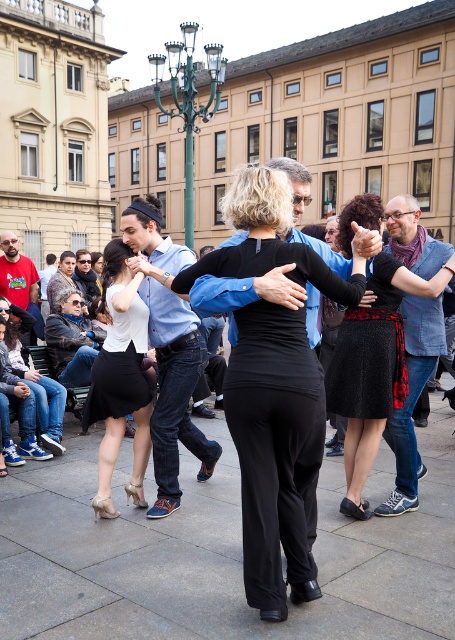
You are standing in the public square and want to take a photo of the point at coordinates (134, 442). The camera you have can only focus on objects within 5 meters. Will the point be in focus?

The point at coordinates (134, 442) is 5.29 meters away from the camera, which is beyond the 5 meter focus range. Therefore, the point will not be in focus.